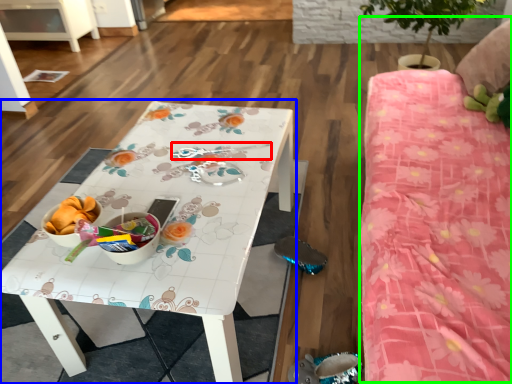
Question: Which object is the closest to the twin (highlighted by a red box)? Choose among these: table (highlighted by a blue box) or bed (highlighted by a green box).

Choices:
 (A) table
 (B) bed

Answer: (A)